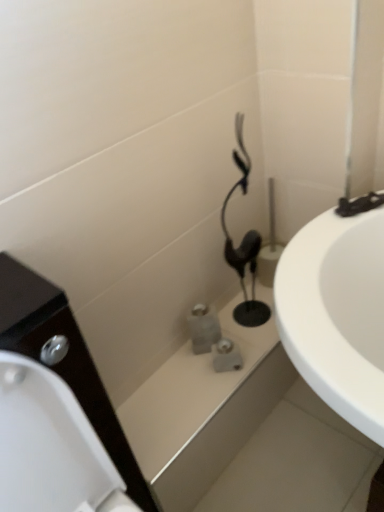
In order to face black plastic hairdryer at center, should I rotate leftwards or rightwards?

Turn right by 6.992 degrees to look at black plastic hairdryer at center.

In order to click on matte gray stone bath at center, the 2th bath from the front in this screenshot , I will do `click(204, 410)`.

How many degrees apart are the facing directions of white glossy bath at center, acting as the 2th bath starting from the back, and black plastic hairdryer at center?

There is a 1.38-degree angle between the facing directions of white glossy bath at center, acting as the 2th bath starting from the back, and black plastic hairdryer at center.

Who is taller, white glossy bath at center, acting as the 2th bath starting from the back, or black plastic hairdryer at center?

With more height is white glossy bath at center, acting as the 2th bath starting from the back.

Locate an element on the screen. The image size is (384, 512). the 2nd bath counting from the left side of the black plastic hairdryer at center is located at coordinates (204, 410).

Which of these two, white glossy bath at center, which is counted as the 1th bath, starting from the front, or black plastic hairdryer at center, is wider?

white glossy bath at center, which is counted as the 1th bath, starting from the front, is wider.

Can you tell me how much black plastic hairdryer at center and white glossy bath at center, which is counted as the 1th bath, starting from the front, differ in facing direction?

The facing directions of black plastic hairdryer at center and white glossy bath at center, which is counted as the 1th bath, starting from the front, are 1.38 degrees apart.

Is black plastic hairdryer at center spatially inside white glossy bath at center, which is counted as the 1th bath, starting from the front, or outside of it?

black plastic hairdryer at center is not inside white glossy bath at center, which is counted as the 1th bath, starting from the front, it's outside.

Locate an element on the screen. This screenshot has height=512, width=384. plumbing fixture behind the white glossy bath at center, acting as the 2th bath starting from the back is located at coordinates (244, 243).

Considering the relative positions of black plastic hairdryer at center and white glossy bath at center, which is counted as the 1th bath, starting from the front, in the image provided, is black plastic hairdryer at center to the left of white glossy bath at center, which is counted as the 1th bath, starting from the front, from the viewer's perspective?

Incorrect, black plastic hairdryer at center is not on the left side of white glossy bath at center, which is counted as the 1th bath, starting from the front.

Is black plastic hairdryer at center positioned in front of matte gray stone bath at center, the first bath from the back?

Yes, it is.

Is point (252, 321) closer or farther from the camera than point (166, 380)?

Point (252, 321).

How many degrees apart are the facing directions of black plastic hairdryer at center and matte gray stone bath at center, the first bath from the back?

1.13 degrees separate the facing orientations of black plastic hairdryer at center and matte gray stone bath at center, the first bath from the back.

Does black plastic hairdryer at center appear on the left side of matte gray stone bath at center, the first bath from the back?

No.

From the image's perspective, does matte gray stone bath at center, the first bath from the back, appear lower than black plastic hairdryer at center?

Yes.

From a real-world perspective, does matte gray stone bath at center, the 2th bath from the front, stand above black plastic hairdryer at center?

No, from a real-world perspective, matte gray stone bath at center, the 2th bath from the front, is not on top of black plastic hairdryer at center.

Is matte gray stone bath at center, the 2th bath from the front, facing away from black plastic hairdryer at center?

No, matte gray stone bath at center, the 2th bath from the front, is not facing the opposite direction of black plastic hairdryer at center.

In the scene shown: Is white glossy bath at center, acting as the 2th bath starting from the back, in front of or behind matte gray stone bath at center, the 2th bath from the front, in the image?

white glossy bath at center, acting as the 2th bath starting from the back, is positioned closer to the viewer than matte gray stone bath at center, the 2th bath from the front.

Does white glossy bath at center, acting as the 2th bath starting from the back, turn towards matte gray stone bath at center, the 2th bath from the front?

No, white glossy bath at center, acting as the 2th bath starting from the back, is not turned towards matte gray stone bath at center, the 2th bath from the front.

Between white glossy bath at center, acting as the 2th bath starting from the back, and matte gray stone bath at center, the first bath from the back, which one has less height?

matte gray stone bath at center, the first bath from the back, is shorter.

Considering the positions of point (178, 370) and point (240, 387), is point (178, 370) closer or farther from the camera than point (240, 387)?

Point (178, 370).

Would you say matte gray stone bath at center, the first bath from the back, contains white glossy bath at center, which is counted as the 1th bath, starting from the front?

No, white glossy bath at center, which is counted as the 1th bath, starting from the front, is located outside of matte gray stone bath at center, the first bath from the back.

Identify the location of bath located underneath the white glossy bath at center, which is counted as the 1th bath, starting from the front (from a real-world perspective). The image size is (384, 512). (204, 410).

What are the coordinates of `the 2nd bath counting from the left of the black plastic hairdryer at center` in the screenshot? It's located at (204, 410).

From a real-world perspective, which bath is the 1st one underneath the black plastic hairdryer at center? Please provide its 2D coordinates.

[(204, 410)]

When comparing their distances from black plastic hairdryer at center, does white glossy bath at center, which is counted as the 1th bath, starting from the front, or matte gray stone bath at center, the 2th bath from the front, seem closer?

The object closer to black plastic hairdryer at center is white glossy bath at center, which is counted as the 1th bath, starting from the front.

From the image, which object appears to be nearer to white glossy bath at center, which is counted as the 1th bath, starting from the front, matte gray stone bath at center, the first bath from the back, or black plastic hairdryer at center?

matte gray stone bath at center, the first bath from the back, lies closer to white glossy bath at center, which is counted as the 1th bath, starting from the front, than the other object.

Which object lies nearer to the anchor point black plastic hairdryer at center, matte gray stone bath at center, the 2th bath from the front, or white glossy bath at center, which is counted as the 1th bath, starting from the front?

white glossy bath at center, which is counted as the 1th bath, starting from the front, is positioned closer to the anchor black plastic hairdryer at center.

Estimate the real-world distances between objects in this image. Which object is further from white glossy bath at center, which is counted as the 1th bath, starting from the front, black plastic hairdryer at center or matte gray stone bath at center, the 2th bath from the front?

Based on the image, black plastic hairdryer at center appears to be further to white glossy bath at center, which is counted as the 1th bath, starting from the front.

Which object lies nearer to the anchor point matte gray stone bath at center, the 2th bath from the front, white glossy bath at center, acting as the 2th bath starting from the back, or black plastic hairdryer at center?

The object closer to matte gray stone bath at center, the 2th bath from the front, is white glossy bath at center, acting as the 2th bath starting from the back.

Looking at the image, which one is located further to matte gray stone bath at center, the 2th bath from the front, black plastic hairdryer at center or white glossy bath at center, acting as the 2th bath starting from the back?

black plastic hairdryer at center is further to matte gray stone bath at center, the 2th bath from the front.

Find the location of a particular element. This screenshot has height=512, width=384. plumbing fixture between white glossy bath at center, acting as the 2th bath starting from the back, and matte gray stone bath at center, the first bath from the back, in the front-back direction is located at coordinates (244, 243).